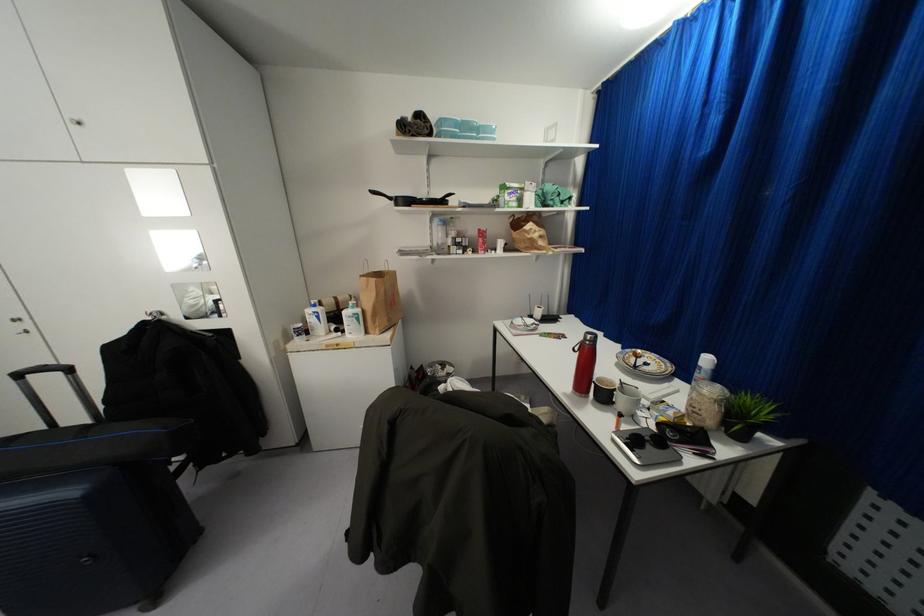
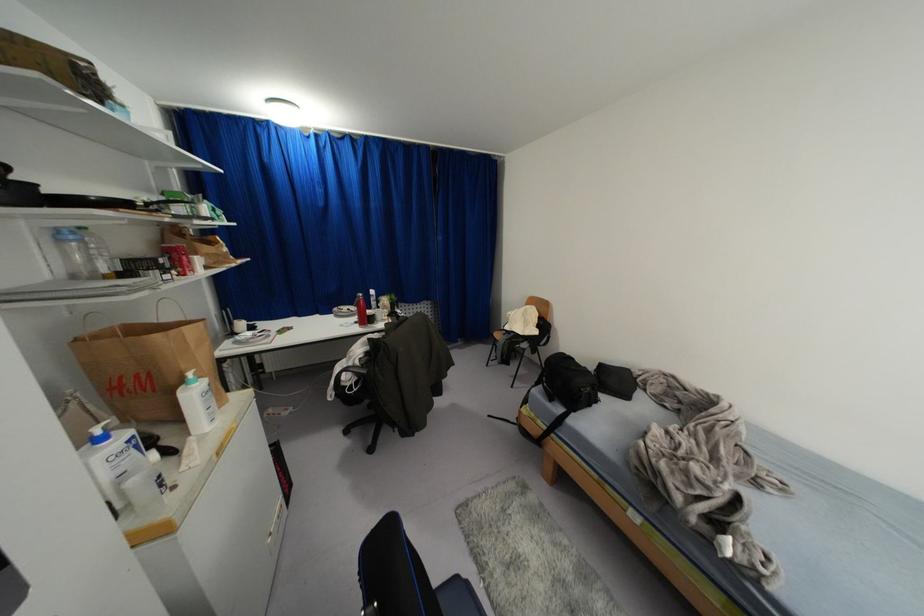
Find the pixel in the second image that matches point 530,315 in the first image.

(234, 333)